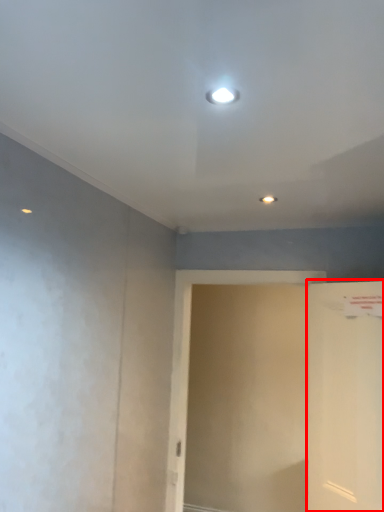
Question: From the image's perspective, where is door (annotated by the red box) located relative to screen door?

Choices:
 (A) above
 (B) below

Answer: (A)